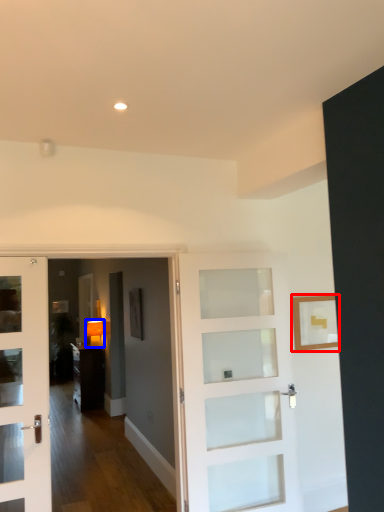
Question: Which of the following is the closest to the observer, picture frame (highlighted by a red box) or lamp (highlighted by a blue box)?

Choices:
 (A) picture frame
 (B) lamp

Answer: (A)